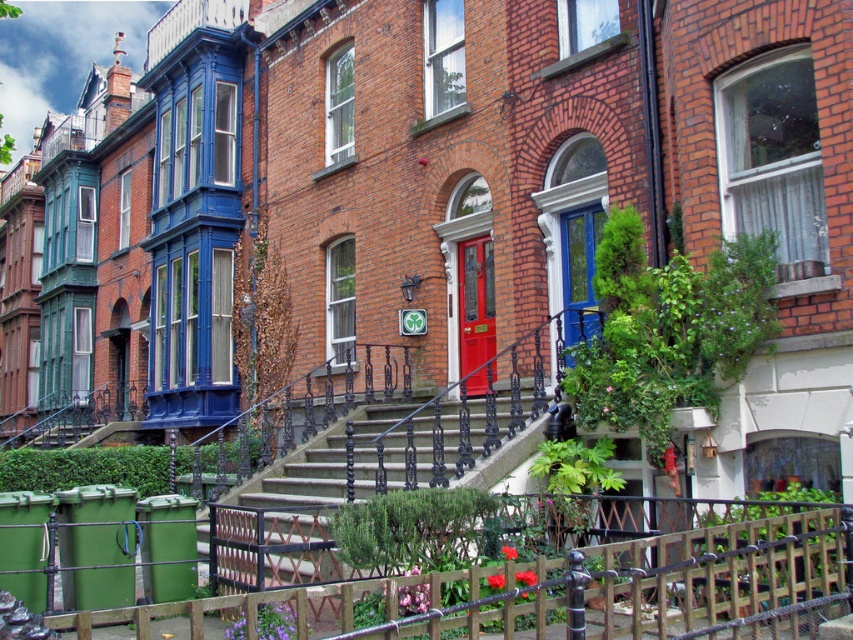
You are standing at the bottom of the black wrought iron staircase leading to the central red brick house. You want to place a new potted plant exactly at the point marked by the coordinate (x=567, y=589). Is this location suitable for placing the potted plant, considering the existing wooden fence at lower center located there?

The point marked by the coordinate (x=567, y=589) corresponds to the wooden fence at lower center. Since fences are typically solid structures, you cannot place a potted plant on top of the wooden fence at lower center as it is not a suitable surface for a potted plant.